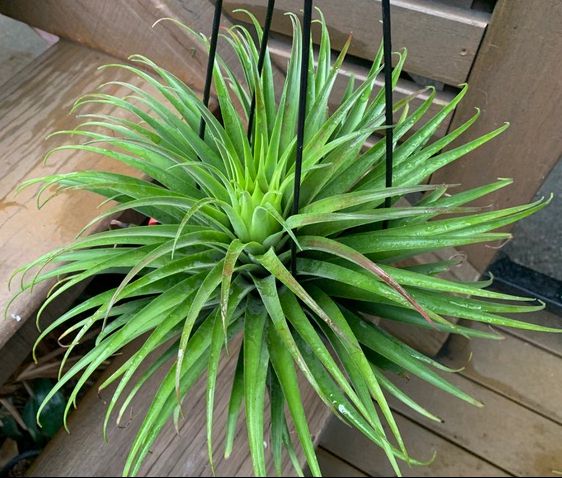
At what (x,y) coordinates should I click in order to perform the action: click on wood of planks. Please return your answer as a coordinate pair (x, y). The width and height of the screenshot is (562, 478). Looking at the image, I should click on (436, 39), (389, 105), (551, 325), (541, 374), (507, 433), (416, 448), (303, 468), (93, 174), (37, 29).